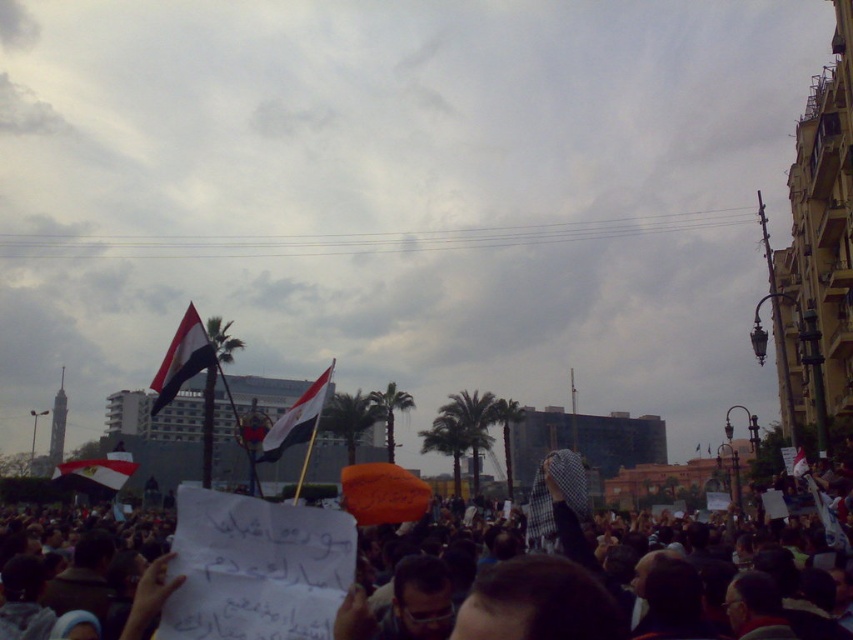
Question: Which point is farther to the camera?

Choices:
 (A) white paper sign at lower center
 (B) matte fabric flag at center

Answer: (B)

Question: Can you confirm if white paper sign at lower center is thinner than matte fabric flag at center?

Choices:
 (A) yes
 (B) no

Answer: (B)

Question: Which of the following is the closest to the observer?

Choices:
 (A) (161, 387)
 (B) (299, 429)
 (C) (345, 490)

Answer: (A)

Question: Is white fabric flag at center further to the viewer compared to matte fabric flag at center?

Choices:
 (A) no
 (B) yes

Answer: (A)

Question: Which point is closer to the camera?

Choices:
 (A) (189, 348)
 (B) (660, 554)

Answer: (A)

Question: Does white paper sign at lower center appear on the right side of red fabric flag at upper left?

Choices:
 (A) no
 (B) yes

Answer: (B)